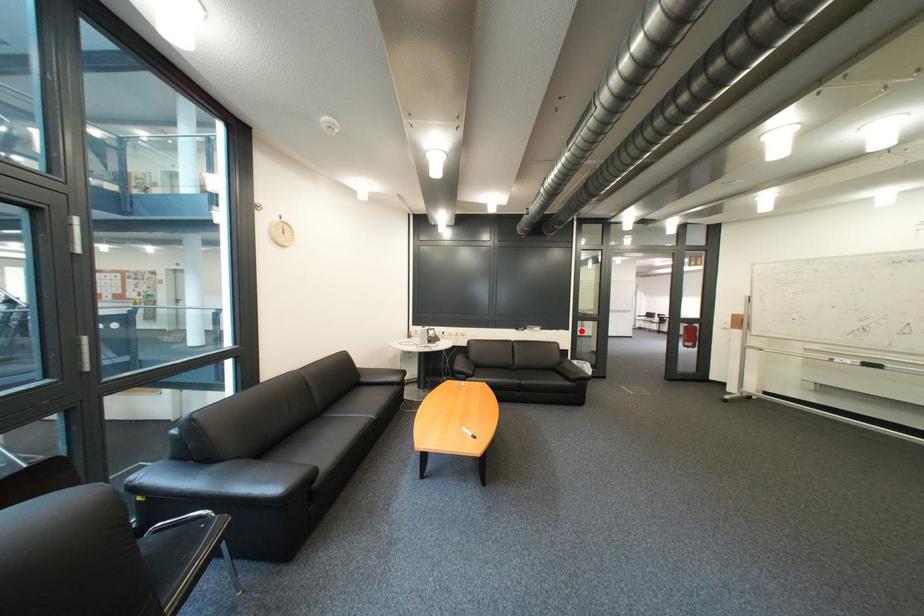
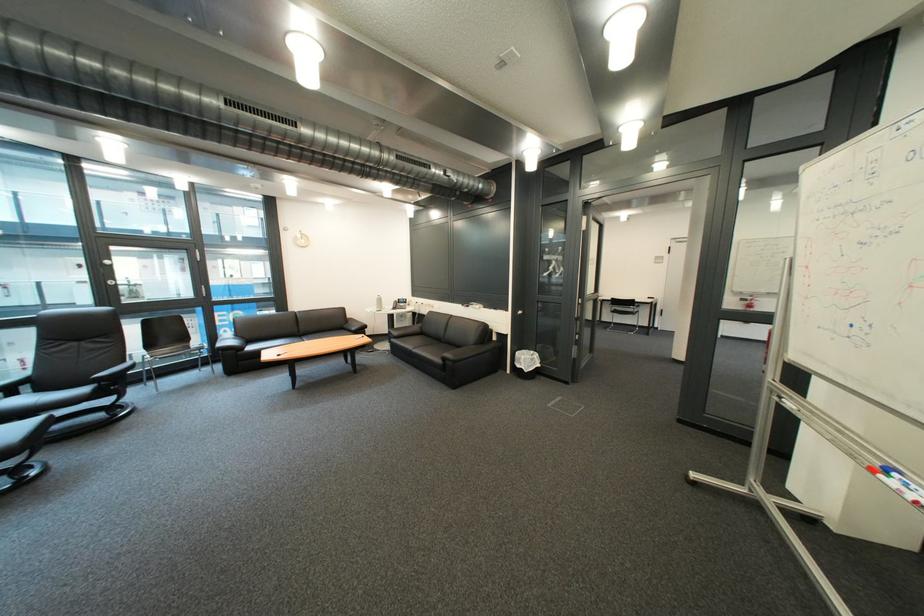
Locate, in the second image, the point that corresponds to the highlighted location in the first image.

(520, 312)